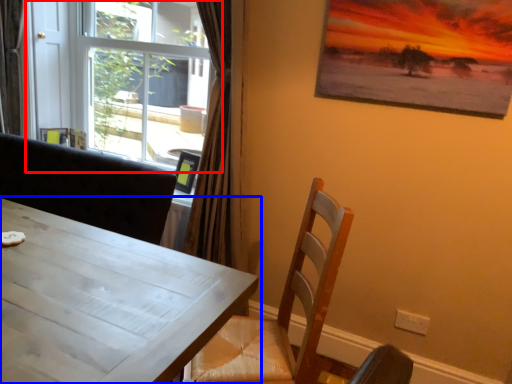
Question: Which point is further to the camera, window (highlighted by a red box) or table (highlighted by a blue box)?

Choices:
 (A) window
 (B) table

Answer: (A)